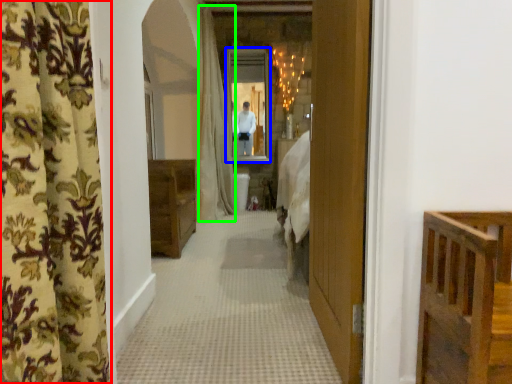
Question: Estimate the real-world distances between objects in this image. Which object is closer to curtain (highlighted by a red box), mirror (highlighted by a blue box) or shower curtain (highlighted by a green box)?

Choices:
 (A) mirror
 (B) shower curtain

Answer: (B)